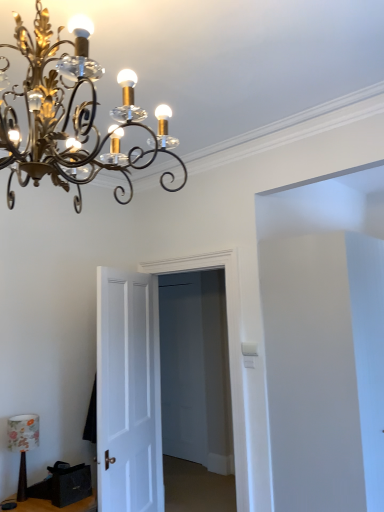
Question: From their relative heights in the image, would you say white wooden door at center, positioned as the 2th door in left-to-right order, is taller or shorter than floral fabric lampshade at lower left, the 2th lamp in the right-to-left sequence?

Choices:
 (A) short
 (B) tall

Answer: (B)

Question: Is point (130, 350) closer or farther from the camera than point (18, 451)?

Choices:
 (A) closer
 (B) farther

Answer: (B)

Question: Based on their relative distances, which object is nearer to the white wooden door at center, which appears as the 1th door when viewed from the right?

Choices:
 (A) floral fabric lampshade at lower left, the 2th lamp positioned from the top
 (B) black fabric speaker at lower left
 (C) black leather drawer at lower left
 (D) gold metallic chandelier at upper left, the 2th lamp in the bottom-to-top sequence
 (E) white matte door at center, positioned as the 1th door in left-to-right order

Answer: (E)

Question: Considering the real-world distances, which object is farthest from the black leather drawer at lower left?

Choices:
 (A) white matte door at center, placed as the second door when sorted from right to left
 (B) white wooden door at center, positioned as the 2th door in left-to-right order
 (C) floral fabric lampshade at lower left, arranged as the second lamp when viewed from the front
 (D) gold metallic chandelier at upper left, the first lamp viewed from the top
 (E) black fabric speaker at lower left

Answer: (D)